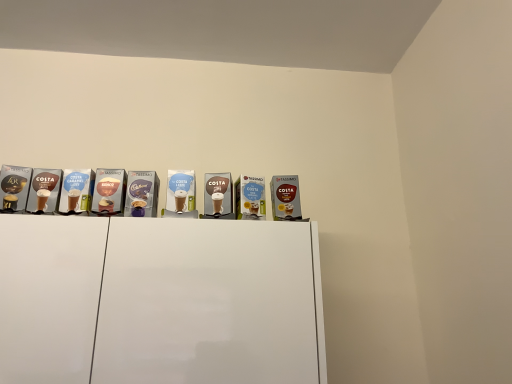
Where is `white glossy cabinet at center`? white glossy cabinet at center is located at coordinates (159, 301).

This screenshot has width=512, height=384. Describe the element at coordinates (159, 301) in the screenshot. I see `white glossy cabinet at center` at that location.

Measure the distance between point (x=8, y=314) and camera.

36.38 inches.

Locate an element on the screen. The image size is (512, 384). white glossy cabinet at center is located at coordinates (159, 301).